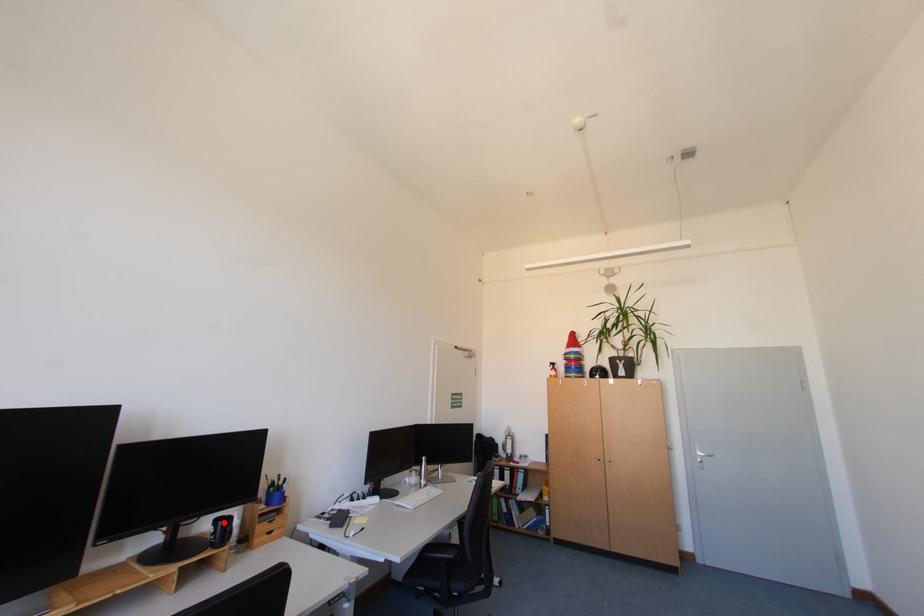
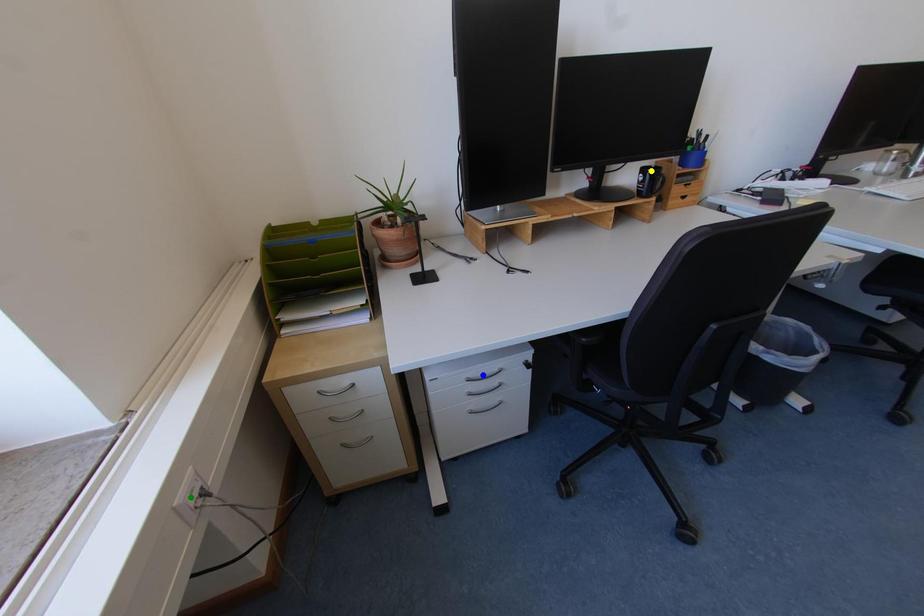
Question: I am providing you with two images of the same scene from different viewpoints. A red point is marked on the first image. You are given multiple points on the second image. Which point in image 2 represents the same 3d spot as the red point in image 1?

Choices:
 (A) yellow point
 (B) green point
 (C) blue point

Answer: (A)